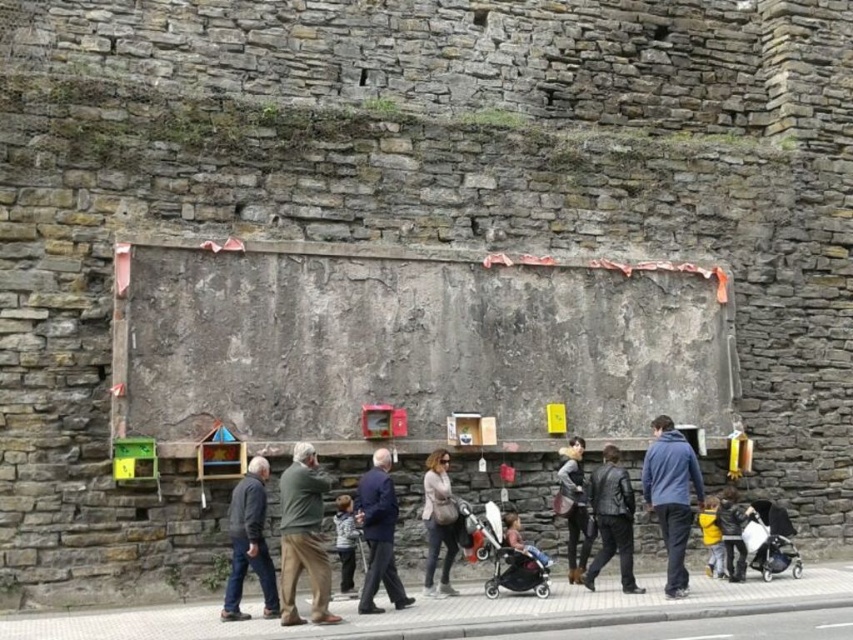
You are standing on the white concrete pavement at lower center and want to move to the blue fleece jacket at lower right. Since the pavement is wider than the jacket, can you walk straight to the jacket without stepping off the pavement?

The white concrete pavement at lower center is wider than the blue fleece jacket at lower right, so yes, you can walk straight to the jacket without stepping off the pavement.